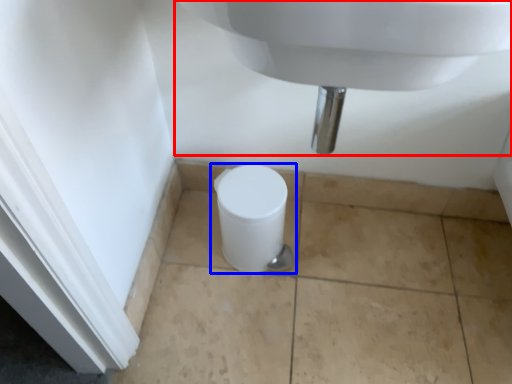
Question: Which point is closer to the camera, sink (highlighted by a red box) or toilet (highlighted by a blue box)?

Choices:
 (A) sink
 (B) toilet

Answer: (A)